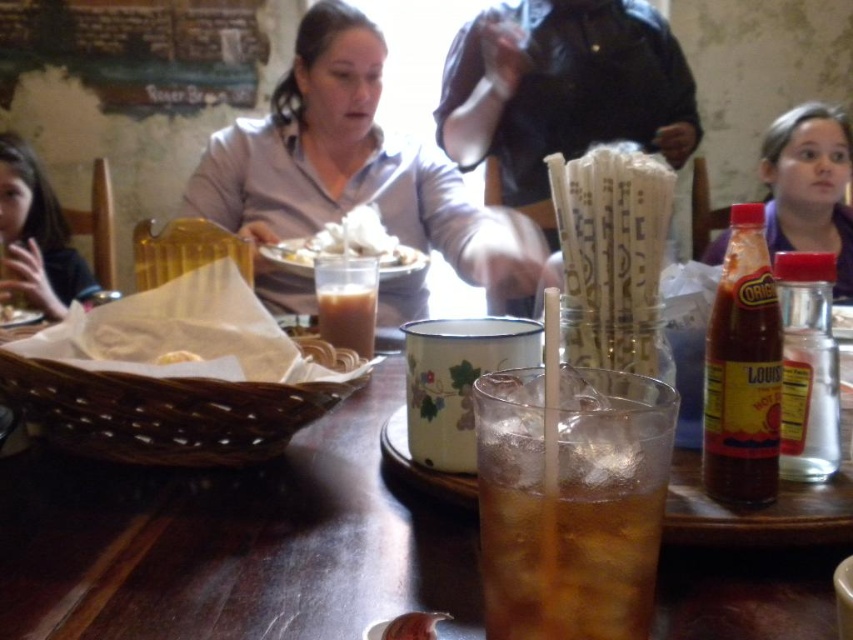
You are a photographer trying to capture a closeup of the objects on the table. You notice two points marked on the table surface. Which point, point 1 at coordinates (161,522) or point 2 at (70,256), is closer to your camera lens?

Point 1 at coordinates (161,522) is closer to the camera lens than point 2 at (70,256).

You are a waiter in a restaurant. You need to place a 4.5 feet long tray between the dark brown hair at left and the white crumbly bread at center. Can you fit the tray between them?

The dark brown hair at left and white crumbly bread at center are 4.65 feet apart from each other. Since the tray is 4.5 feet long, it can fit between them as the distance is slightly larger than the tray.

You are a customer at this restaurant and want to grab the translucent glass at center to take a sip. However, you notice dark brown hair at left is blocking your view of the glass. Can you still reach the glass without moving the hair?

The translucent glass at center is in front of the dark brown hair at left, so you can reach it without moving the hair since it is closer to you than the hair.